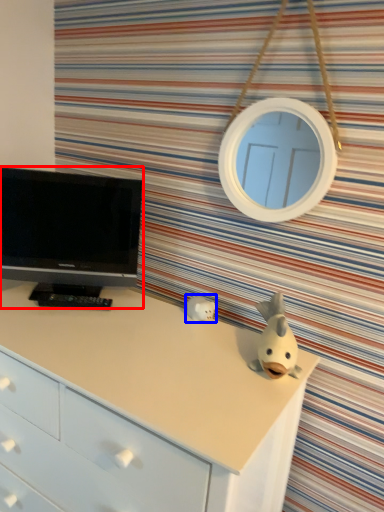
Question: Which object appears farthest to the camera in this image, television (highlighted by a red box) or toy (highlighted by a blue box)?

Choices:
 (A) television
 (B) toy

Answer: (B)